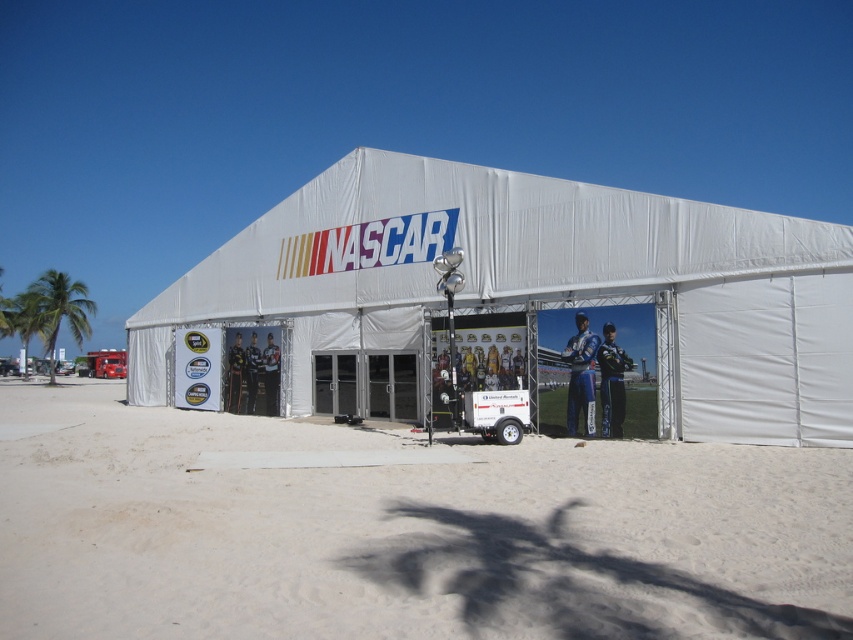
Is white fabric tent at center thinner than blue fabric suit at center?

Incorrect, white fabric tent at center's width is not less than blue fabric suit at center's.

Can you confirm if white fabric tent at center is positioned above blue fabric suit at center?

Yes, white fabric tent at center is above blue fabric suit at center.

This screenshot has width=853, height=640. Describe the element at coordinates (532, 289) in the screenshot. I see `white fabric tent at center` at that location.

Identify the location of white fabric tent at center. (532, 289).

Is point (537, 513) more distant than point (268, 333)?

No, it is not.

Does white sand at lower center have a greater height compared to matte black racing suit at lower left?

In fact, white sand at lower center may be shorter than matte black racing suit at lower left.

Image resolution: width=853 pixels, height=640 pixels. In order to click on white sand at lower center in this screenshot , I will do `click(402, 531)`.

Is blue racing suit at center positioned at the back of matte black suit at center?

No, blue racing suit at center is in front of matte black suit at center.

Which is below, blue racing suit at center or matte black suit at center?

Positioned lower is matte black suit at center.

What do you see at coordinates (612, 381) in the screenshot?
I see `blue racing suit at center` at bounding box center [612, 381].

Identify the location of blue racing suit at center. This screenshot has height=640, width=853. (612, 381).